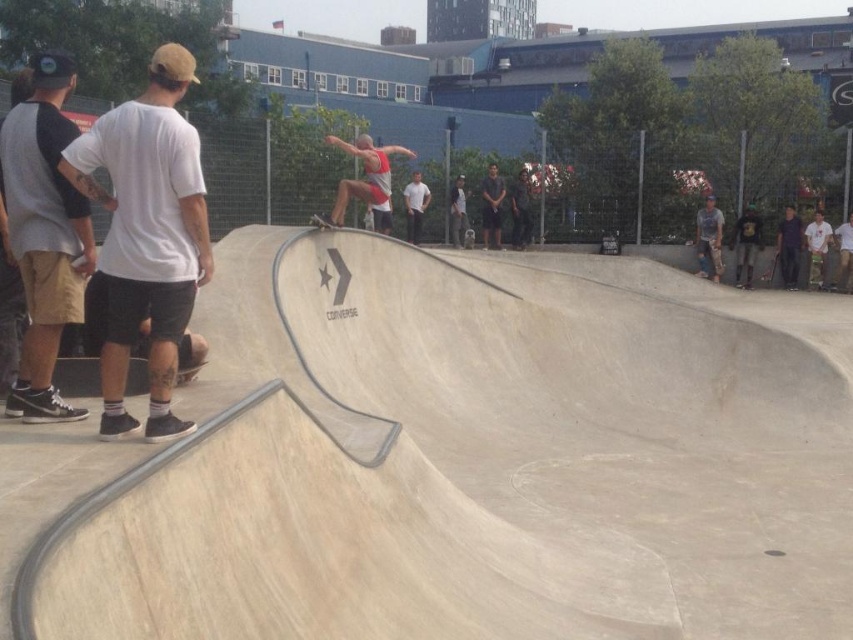
Question: Which of these objects is positioned closest to the dark blue jeans at right?

Choices:
 (A) white matte skateboard at right
 (B) smooth beige skateboard at center
 (C) matte black sneakers at left

Answer: (A)

Question: Can you confirm if light brown leather jacket at center is smaller than wooden skateboard at right?

Choices:
 (A) yes
 (B) no

Answer: (B)

Question: Estimate the real-world distances between objects in this image. Which object is farther from the matte black sneakers at left?

Choices:
 (A) smooth black skateboard at right
 (B) smooth beige skateboard at center

Answer: (A)

Question: Is smooth concrete skate park at center bigger than light brown leather jacket at center?

Choices:
 (A) no
 (B) yes

Answer: (B)

Question: Is dark gray t-shirt at center to the right of smooth beige skateboard at center from the viewer's perspective?

Choices:
 (A) no
 (B) yes

Answer: (B)

Question: Which point is farther to the camera?

Choices:
 (A) smooth beige skateboard at center
 (B) matte red tank top at center
 (C) smooth black skateboard at right
 (D) matte black sneakers at left

Answer: (C)